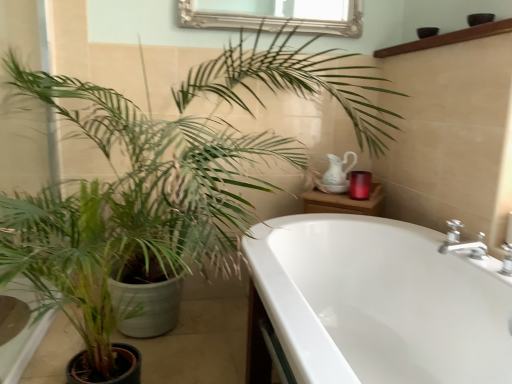
Question: Is point (327, 375) closer or farther from the camera than point (473, 31)?

Choices:
 (A) farther
 (B) closer

Answer: (B)

Question: From the image's perspective, relative to brown wooden balustrade at upper right, is white glossy bathtub at lower right above or below?

Choices:
 (A) below
 (B) above

Answer: (A)

Question: Which of these objects is positioned closest to the brown wooden balustrade at upper right?

Choices:
 (A) green matte plant at left
 (B) white glossy bathtub at lower right

Answer: (B)

Question: Considering the real-world distances, which object is closest to the brown wooden balustrade at upper right?

Choices:
 (A) white glossy bathtub at lower right
 (B) green matte plant at left

Answer: (A)